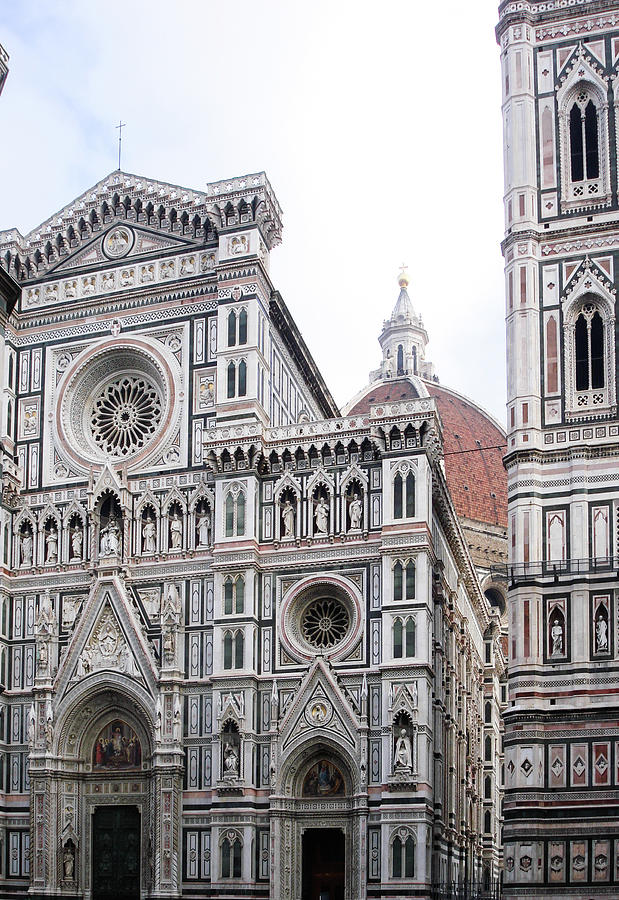
Where is `circular windows`? Image resolution: width=619 pixels, height=900 pixels. circular windows is located at coordinates (113, 371), (329, 588).